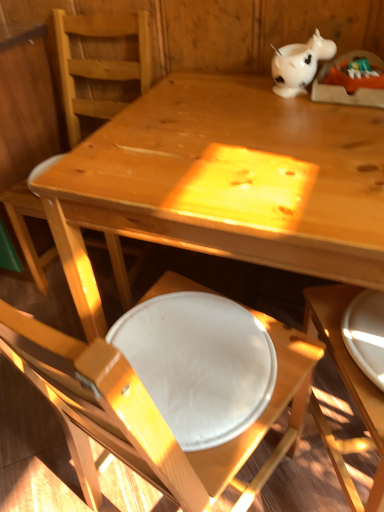
At what (x,y) coordinates should I click in order to perform the action: click on white glossy plate at lower center, which is the second chair in back-to-front order. Please return your answer as a coordinate pair (x, y). The width and height of the screenshot is (384, 512). Looking at the image, I should click on [x=265, y=417].

Describe the element at coordinates (99, 63) in the screenshot. The width and height of the screenshot is (384, 512). I see `matte wood chair at center, which is counted as the 2th chair, starting from the front` at that location.

The image size is (384, 512). What are the coordinates of `white glossy plate at lower center, which is the second chair in back-to-front order` in the screenshot? It's located at pos(265,417).

Is matte wood chair at center, which ranks as the first chair in back-to-front order, positioned with its back to white glossy plate at lower center, acting as the first chair starting from the front?

That's not correct — matte wood chair at center, which ranks as the first chair in back-to-front order, is not looking away from white glossy plate at lower center, acting as the first chair starting from the front.

From the picture: Does matte wood chair at center, which ranks as the first chair in back-to-front order, have a larger size compared to white glossy plate at lower center, which is the second chair in back-to-front order?

Indeed, matte wood chair at center, which ranks as the first chair in back-to-front order, has a larger size compared to white glossy plate at lower center, which is the second chair in back-to-front order.

Considering the positions of points (44, 261) and (307, 376), is point (44, 261) closer to camera compared to point (307, 376)?

No, it is behind (307, 376).

The width and height of the screenshot is (384, 512). What are the coordinates of `chair above the matte wood chair at center, which is counted as the 2th chair, starting from the front (from a real-world perspective)` in the screenshot? It's located at (265, 417).

How different are the orientations of white glossy plate at lower right and matte wood chair at center, which is counted as the 2th chair, starting from the front, in degrees?

149 degrees separate the facing orientations of white glossy plate at lower right and matte wood chair at center, which is counted as the 2th chair, starting from the front.

Is white glossy plate at lower right oriented towards matte wood chair at center, which ranks as the first chair in back-to-front order?

No, white glossy plate at lower right is not aimed at matte wood chair at center, which ranks as the first chair in back-to-front order.

Is matte wood chair at center, which ranks as the first chair in back-to-front order, surrounded by white glossy plate at lower right?

Actually, matte wood chair at center, which ranks as the first chair in back-to-front order, is outside white glossy plate at lower right.

Is white glossy plate at lower right further to the viewer compared to matte wood chair at center, which ranks as the first chair in back-to-front order?

That is False.

Is white glossy plate at lower center, acting as the first chair starting from the front, oriented away from white glossy plate at lower right?

white glossy plate at lower center, acting as the first chair starting from the front, is not turned away from white glossy plate at lower right.

Is white glossy plate at lower center, which is the second chair in back-to-front order, completely or partially outside of white glossy plate at lower right?

white glossy plate at lower center, which is the second chair in back-to-front order, is positioned outside white glossy plate at lower right.

Considering the sizes of objects white glossy plate at lower center, which is the second chair in back-to-front order, and white glossy plate at lower right in the image provided, who is taller, white glossy plate at lower center, which is the second chair in back-to-front order, or white glossy plate at lower right?

Standing taller between the two is white glossy plate at lower center, which is the second chair in back-to-front order.

Between point (259, 488) and point (375, 323), which one is positioned in front?

The point (375, 323) is in front.

Is white glossy plate at lower right smaller than white glossy plate at lower center, which is the second chair in back-to-front order?

Yes.

Does white glossy plate at lower right appear on the right side of white glossy plate at lower center, which is the second chair in back-to-front order?

Indeed, white glossy plate at lower right is positioned on the right side of white glossy plate at lower center, which is the second chair in back-to-front order.

From the image's perspective, which one is positioned lower, white glossy plate at lower right or white glossy plate at lower center, which is the second chair in back-to-front order?

From the image's view, white glossy plate at lower center, which is the second chair in back-to-front order, is below.

What are the coordinates of `plate that is above the white glossy plate at lower center, acting as the first chair starting from the front (from the image's perspective)` in the screenshot? It's located at (366, 333).

Image resolution: width=384 pixels, height=512 pixels. Find the location of `plate lying below the white glossy piggy bank at upper right (from the image's perspective)`. plate lying below the white glossy piggy bank at upper right (from the image's perspective) is located at coordinates (366, 333).

How many degrees apart are the facing directions of white glossy plate at lower right and white glossy piggy bank at upper right?

They differ by 149 degrees in their facing directions.

Who is bigger, white glossy plate at lower right or white glossy piggy bank at upper right?

Bigger between the two is white glossy piggy bank at upper right.

Which of these two, white glossy plate at lower right or white glossy piggy bank at upper right, is thinner?

With smaller width is white glossy piggy bank at upper right.

Identify the location of plate located in front of the matte wood chair at center, which ranks as the first chair in back-to-front order. (366, 333).

Which object is thinner, matte wood chair at center, which ranks as the first chair in back-to-front order, or white glossy plate at lower right?

white glossy plate at lower right is thinner.

Is matte wood chair at center, which ranks as the first chair in back-to-front order, positioned with its back to white glossy plate at lower right?

matte wood chair at center, which ranks as the first chair in back-to-front order, is not turned away from white glossy plate at lower right.

From a real-world perspective, is matte wood chair at center, which ranks as the first chair in back-to-front order, positioned under white glossy piggy bank at upper right based on gravity?

Indeed, from a real-world perspective, matte wood chair at center, which ranks as the first chair in back-to-front order, is positioned beneath white glossy piggy bank at upper right.

Considering the sizes of objects matte wood chair at center, which ranks as the first chair in back-to-front order, and white glossy piggy bank at upper right in the image provided, who is shorter, matte wood chair at center, which ranks as the first chair in back-to-front order, or white glossy piggy bank at upper right?

With less height is white glossy piggy bank at upper right.

Which point is more forward, (73, 128) or (309, 69)?

Positioned in front is point (309, 69).

Identify the location of chair on the right of the matte wood chair at center, which is counted as the 2th chair, starting from the front. Image resolution: width=384 pixels, height=512 pixels. (265, 417).

Where is `chair behind the white glossy plate at lower right`? chair behind the white glossy plate at lower right is located at coordinates (99, 63).

Estimate the real-world distances between objects in this image. Which object is further from white glossy plate at lower right, white glossy piggy bank at upper right or white glossy plate at lower center, acting as the first chair starting from the front?

Among the two, white glossy piggy bank at upper right is located further to white glossy plate at lower right.

When comparing their distances from white glossy piggy bank at upper right, does white glossy plate at lower center, acting as the first chair starting from the front, or white glossy plate at lower right seem further?

white glossy plate at lower center, acting as the first chair starting from the front, is further to white glossy piggy bank at upper right.

Considering their positions, is matte wood chair at center, which is counted as the 2th chair, starting from the front, positioned closer to white glossy plate at lower right than white glossy plate at lower center, acting as the first chair starting from the front?

white glossy plate at lower center, acting as the first chair starting from the front, is positioned closer to the anchor white glossy plate at lower right.

When comparing their distances from white glossy plate at lower center, which is the second chair in back-to-front order, does matte wood chair at center, which ranks as the first chair in back-to-front order, or white glossy piggy bank at upper right seem further?

matte wood chair at center, which ranks as the first chair in back-to-front order, lies further to white glossy plate at lower center, which is the second chair in back-to-front order, than the other object.

Estimate the real-world distances between objects in this image. Which object is closer to white glossy plate at lower center, which is the second chair in back-to-front order, matte wood chair at center, which is counted as the 2th chair, starting from the front, or white glossy plate at lower right?

white glossy plate at lower right.

Looking at the image, which one is located further to matte wood chair at center, which ranks as the first chair in back-to-front order, white glossy piggy bank at upper right or white glossy plate at lower center, acting as the first chair starting from the front?

white glossy plate at lower center, acting as the first chair starting from the front, is further to matte wood chair at center, which ranks as the first chair in back-to-front order.

Which object lies nearer to the anchor point white glossy plate at lower right, white glossy piggy bank at upper right or matte wood chair at center, which ranks as the first chair in back-to-front order?

white glossy piggy bank at upper right is positioned closer to the anchor white glossy plate at lower right.

Which object lies nearer to the anchor point white glossy plate at lower center, which is the second chair in back-to-front order, white glossy plate at lower right or matte wood chair at center, which ranks as the first chair in back-to-front order?

white glossy plate at lower right.

Identify the location of tableware located between matte wood chair at center, which is counted as the 2th chair, starting from the front, and white glossy plate at lower right in the left-right direction. (299, 64).

The height and width of the screenshot is (512, 384). In order to click on chair between matte wood chair at center, which ranks as the first chair in back-to-front order, and white glossy plate at lower right in this screenshot , I will do 265,417.

Where is `chair between white glossy piggy bank at upper right and white glossy plate at lower center, which is the second chair in back-to-front order, in the up-down direction`? The image size is (384, 512). chair between white glossy piggy bank at upper right and white glossy plate at lower center, which is the second chair in back-to-front order, in the up-down direction is located at coordinates (99, 63).

Find the location of a particular element. Image resolution: width=384 pixels, height=512 pixels. plate between white glossy piggy bank at upper right and white glossy plate at lower center, which is the second chair in back-to-front order, from top to bottom is located at coordinates (366, 333).